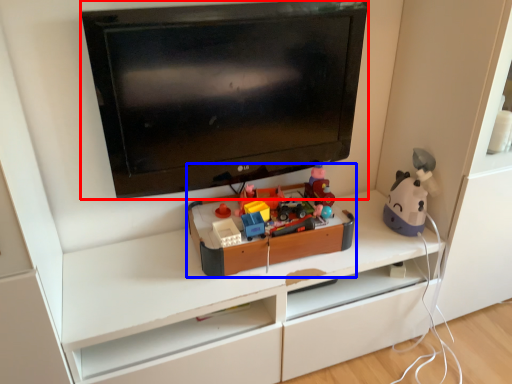
Question: Which object is closer to the camera taking this photo, television (highlighted by a red box) or toy (highlighted by a blue box)?

Choices:
 (A) television
 (B) toy

Answer: (A)